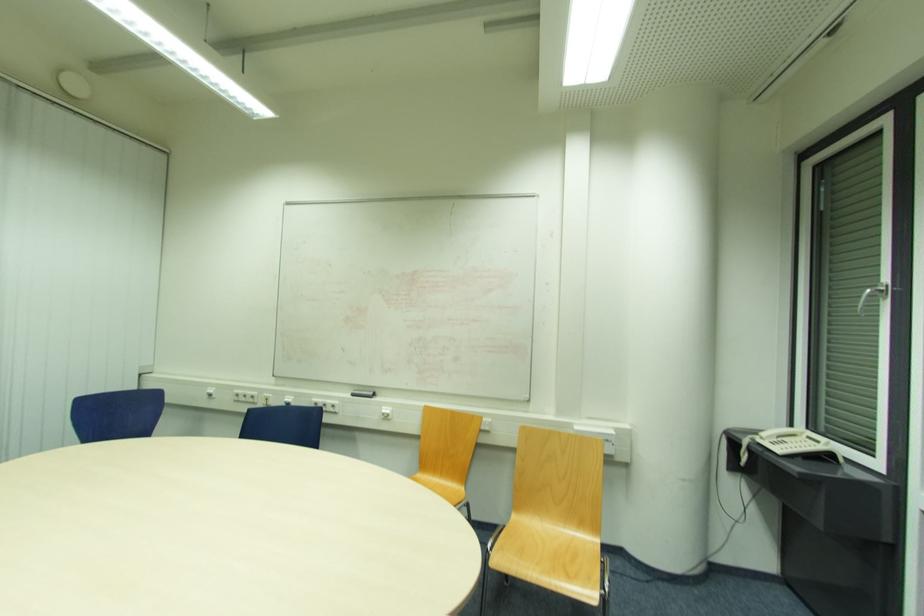
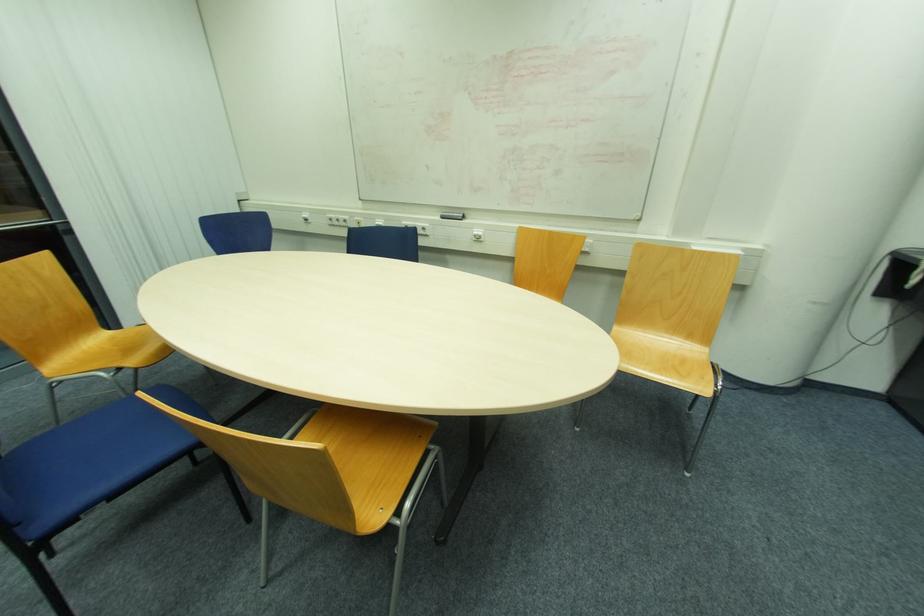
Question: How did the camera likely rotate?

Choices:
 (A) Left
 (B) Right
 (C) Up
 (D) Down

Answer: (D)